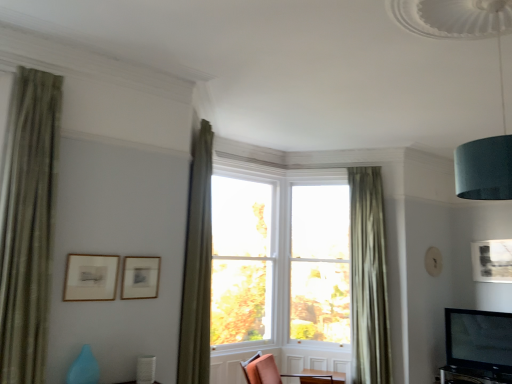
Question: Considering the positions of point (507, 256) and point (335, 264), is point (507, 256) closer or farther from the camera than point (335, 264)?

Choices:
 (A) closer
 (B) farther

Answer: (A)

Question: From a real-world perspective, relative to clear glass window at center, is matte black picture frame at upper right, the third picture frame viewed from the left, vertically above or below?

Choices:
 (A) above
 (B) below

Answer: (A)

Question: Which is nearer to the matte gold picture frame at upper left, placed as the second picture frame when sorted from back to front?

Choices:
 (A) clear glass window at center
 (B) green textured curtain at upper center, which is counted as the 2th curtain, starting from the right
 (C) clear glass window at center
 (D) teal fabric lampshade at upper right
 (E) green sheer curtain at right, which is the 1th curtain in back-to-front order

Answer: (B)

Question: Estimate the real-world distances between objects in this image. Which object is closer to the matte orange chair at center?

Choices:
 (A) matte black picture frame at upper right, the third picture frame viewed from the left
 (B) green textured curtain at upper center, acting as the 2th curtain starting from the back
 (C) clear glass window at center
 (D) clear glass window at center
 (E) teal fabric lampshade at upper right

Answer: (B)